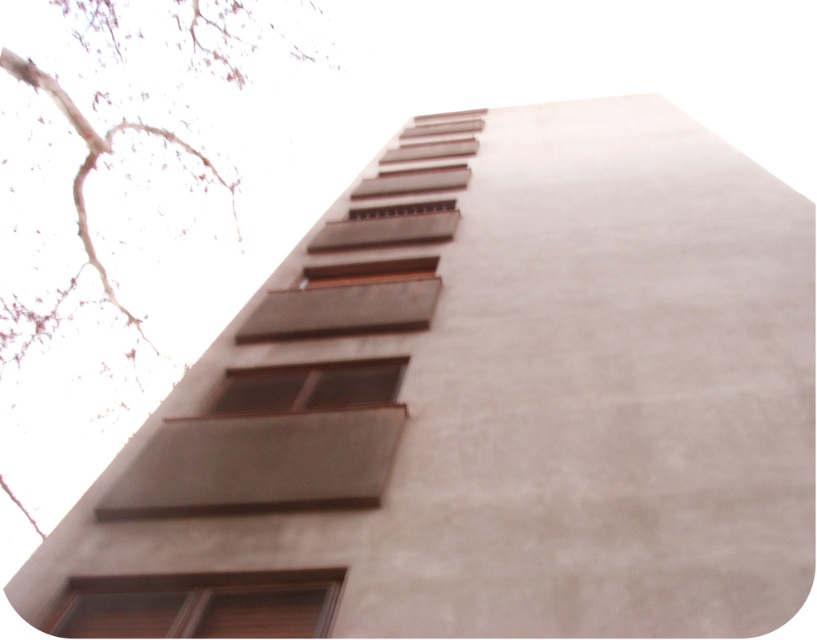
Can you confirm if brown wood tree at upper left is wider than brown matte window at center?

Yes.

In the scene shown: Between brown wood tree at upper left and brown matte window at center, which one appears on the right side from the viewer's perspective?

brown matte window at center is more to the right.

The width and height of the screenshot is (817, 640). I want to click on brown wood tree at upper left, so click(x=117, y=163).

Who is shorter, brown wooden window at lower left or brown matte window at center?

With less height is brown wooden window at lower left.

Find the location of a particular element. The image size is (817, 640). brown wooden window at lower left is located at coordinates (199, 604).

You are a GUI agent. You are given a task and a screenshot of the screen. Output one action in this format:
    pyautogui.click(x=<x>, y=<y>)
    Task: Click on the brown wooden window at lower left
    
    Given the screenshot: What is the action you would take?
    click(199, 604)

Does brown wood tree at upper left have a lesser width compared to brown wooden window at lower left?

No, brown wood tree at upper left is not thinner than brown wooden window at lower left.

Is point (212, 4) more distant than point (87, 611)?

Yes, point (212, 4) is behind point (87, 611).

Is point (1, 225) behind point (150, 580)?

Yes.

Identify the location of brown wood tree at upper left. The image size is (817, 640). (117, 163).